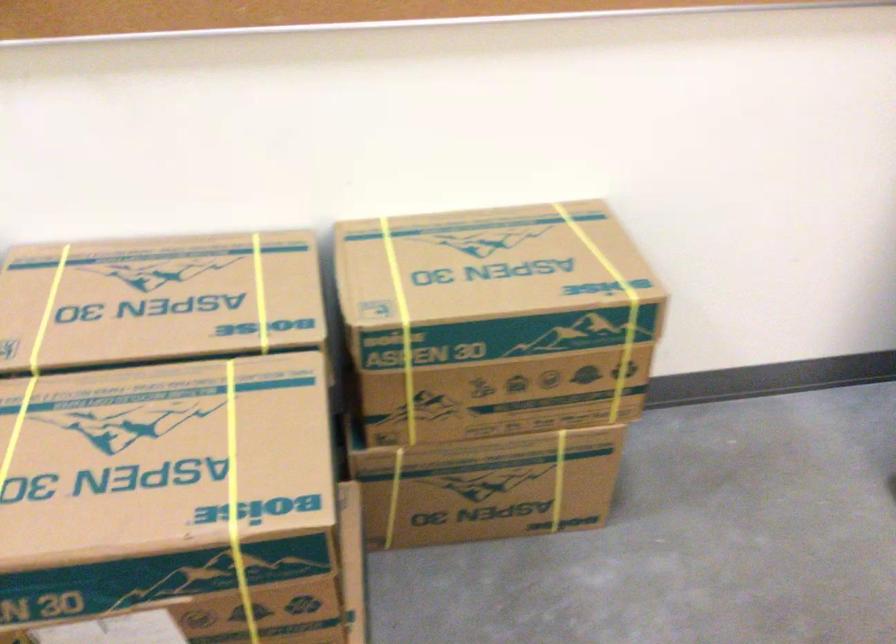
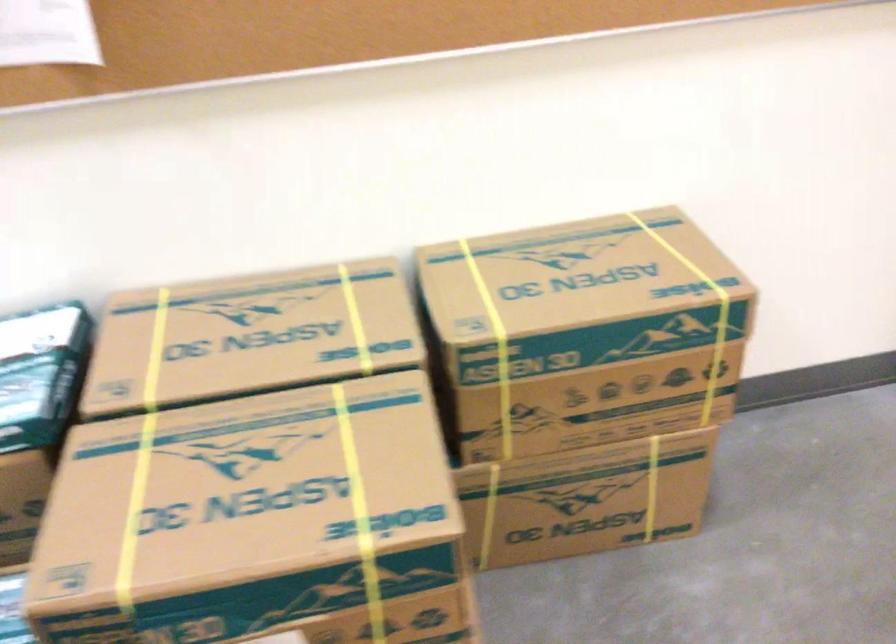
Question: Which direction would the cameraman need to move to produce the second image? Reply with the corresponding letter.

Choices:
 (A) Left
 (B) Right
 (C) Forward
 (D) Backward

Answer: (A)